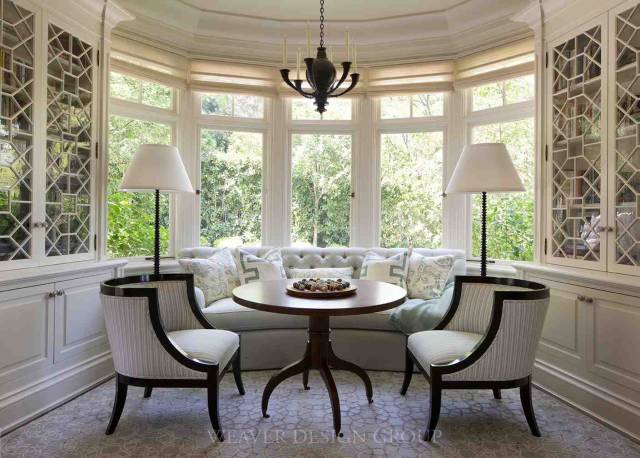
Where is `window`? This screenshot has height=458, width=640. window is located at coordinates (260, 225).